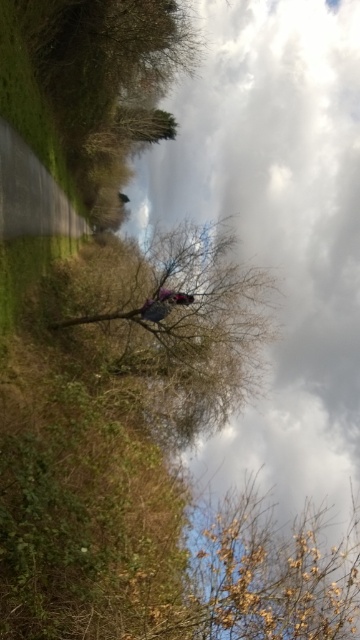
Question: Is cloudy sky at upper center further to the viewer compared to brown textured tree at center?

Choices:
 (A) no
 (B) yes

Answer: (A)

Question: Is cloudy sky at upper center further to camera compared to brown textured tree at center?

Choices:
 (A) no
 (B) yes

Answer: (A)

Question: Observing the image, what is the correct spatial positioning of cloudy sky at upper center in reference to brown textured tree at center?

Choices:
 (A) right
 (B) left

Answer: (A)

Question: Which of the following is the closest to the observer?

Choices:
 (A) brown textured tree at center
 (B) cloudy sky at upper center

Answer: (B)

Question: Which point appears farthest from the camera in this image?

Choices:
 (A) (254, 83)
 (B) (181, 294)

Answer: (A)